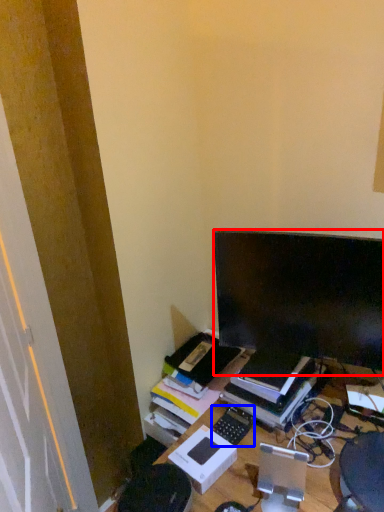
Question: Among these objects, which one is nearest to the camera, computer monitor (highlighted by a red box) or computer keyboard (highlighted by a blue box)?

Choices:
 (A) computer monitor
 (B) computer keyboard

Answer: (A)